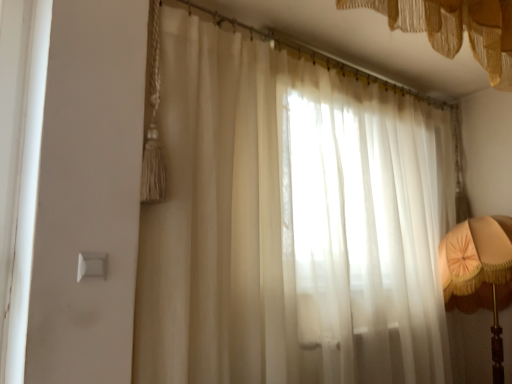
Question: Looking at their shapes, would you say matte orange fabric lampshade at right is wider or thinner than white plastic light switch at lower left?

Choices:
 (A) thin
 (B) wide

Answer: (B)

Question: Is point (495, 304) closer or farther from the camera than point (80, 269)?

Choices:
 (A) farther
 (B) closer

Answer: (A)

Question: Which object is the closest to the matte orange fabric lampshade at right?

Choices:
 (A) white plastic light switch at lower left
 (B) translucent fabric curtain at upper center, the 1th curtain positioned from the top
 (C) sheer white curtain at center, the 1th curtain from the bottom

Answer: (C)

Question: Which is farther from the sheer white curtain at center, which appears as the 2th curtain when viewed from the top?

Choices:
 (A) translucent fabric curtain at upper center, which is the 2th curtain from bottom to top
 (B) matte orange fabric lampshade at right
 (C) white plastic light switch at lower left

Answer: (C)